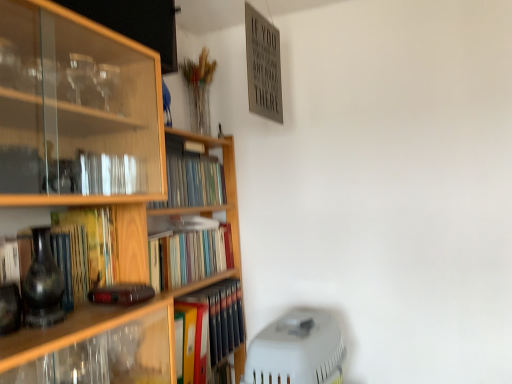
The height and width of the screenshot is (384, 512). What do you see at coordinates (188, 253) in the screenshot? I see `hardcover book at center, which is the 2th book in bottom-to-top order` at bounding box center [188, 253].

I want to click on hardcover book at center-left, the third book ordered from the bottom, so tap(84, 251).

Where is `hardcover book at center, which is the third book in top-to-bottom order`? hardcover book at center, which is the third book in top-to-bottom order is located at coordinates (188, 253).

Can you see hardcover book at center, which is the 2th book in bottom-to-top order, touching hardcover book at center-left, the third book ordered from the bottom?

They are not placed beside each other.

Is hardcover book at center, which is the third book in top-to-bottom order, smaller than hardcover book at center-left, acting as the second book starting from the top?

Incorrect, hardcover book at center, which is the third book in top-to-bottom order, is not smaller in size than hardcover book at center-left, acting as the second book starting from the top.

From their relative heights in the image, would you say hardcover book at center, which is the 2th book in bottom-to-top order, is taller or shorter than hardcover book at center-left, acting as the second book starting from the top?

hardcover book at center, which is the 2th book in bottom-to-top order, is shorter than hardcover book at center-left, acting as the second book starting from the top.

From a real-world perspective, is hardcover book at center, which is the third book in top-to-bottom order, above or below hardcover book at center-left, acting as the second book starting from the top?

hardcover book at center, which is the third book in top-to-bottom order, is situated lower than hardcover book at center-left, acting as the second book starting from the top, in the real world.

Which is behind, point (23, 290) or point (208, 266)?

The point (208, 266) is behind.

Is matte black vase at left oriented away from hardcover book at center, which is the 2th book in bottom-to-top order?

matte black vase at left does not have its back to hardcover book at center, which is the 2th book in bottom-to-top order.

From their relative heights in the image, would you say matte black vase at left is taller or shorter than hardcover book at center, which is the 2th book in bottom-to-top order?

matte black vase at left is taller than hardcover book at center, which is the 2th book in bottom-to-top order.

Is matte black vase at left to the left or to the right of hardcover book at center, which is the third book in top-to-bottom order, in the image?

From the image, it's evident that matte black vase at left is to the left of hardcover book at center, which is the third book in top-to-bottom order.

How many degrees apart are the facing directions of matte black vase at left and hardcover book at center-left, acting as the second book starting from the top?

matte black vase at left and hardcover book at center-left, acting as the second book starting from the top, are facing 0.576 degrees away from each other.

Could you tell me if matte black vase at left is facing hardcover book at center-left, acting as the second book starting from the top?

No, matte black vase at left is not oriented towards hardcover book at center-left, acting as the second book starting from the top.

Considering the sizes of matte black vase at left and hardcover book at center-left, acting as the second book starting from the top, in the image, is matte black vase at left wider or thinner than hardcover book at center-left, acting as the second book starting from the top,?

In the image, matte black vase at left appears to be more narrow than hardcover book at center-left, acting as the second book starting from the top.

Is hardcover book at center-left, the third book ordered from the bottom, inside matte black vase at left?

Definitely not — hardcover book at center-left, the third book ordered from the bottom, is not inside matte black vase at left.

Does hardcover book at center-left, acting as the second book starting from the top, turn towards hardcover books at center, which is the first book in top-to-bottom order?

No.

Is hardcover book at center-left, acting as the second book starting from the top, placed right next to hardcover books at center, which is the first book in top-to-bottom order?

No, hardcover book at center-left, acting as the second book starting from the top, is not with hardcover books at center, which is the first book in top-to-bottom order.

From a real-world perspective, does hardcover book at center-left, acting as the second book starting from the top, sit lower than hardcover books at center, which is the first book in top-to-bottom order?

Yes, from a real-world perspective, hardcover book at center-left, acting as the second book starting from the top, is below hardcover books at center, which is the first book in top-to-bottom order.

Considering the relative positions of matte black vase at left and multicolored hardcover books at center, acting as the 4th book starting from the top, in the image provided, is matte black vase at left to the right of multicolored hardcover books at center, acting as the 4th book starting from the top, from the viewer's perspective?

No, matte black vase at left is not to the right of multicolored hardcover books at center, acting as the 4th book starting from the top.

Is matte black vase at left not near multicolored hardcover books at center, which is the first book in bottom-to-top order?

They are positioned close to each other.

Considering the relative sizes of matte black vase at left and multicolored hardcover books at center, which is the first book in bottom-to-top order, in the image provided, is matte black vase at left wider than multicolored hardcover books at center, which is the first book in bottom-to-top order,?

No, matte black vase at left is not wider than multicolored hardcover books at center, which is the first book in bottom-to-top order.

Considering the relative sizes of matte black vase at left and multicolored hardcover books at center, acting as the 4th book starting from the top, in the image provided, is matte black vase at left bigger than multicolored hardcover books at center, acting as the 4th book starting from the top,?

Actually, matte black vase at left might be smaller than multicolored hardcover books at center, acting as the 4th book starting from the top.

Is matte black vase at left turned away from hardcover books at center, which is the first book in top-to-bottom order?

That's not correct — matte black vase at left is not looking away from hardcover books at center, which is the first book in top-to-bottom order.

Between matte black vase at left and hardcover books at center, which is the first book in top-to-bottom order, which one has larger width?

hardcover books at center, which is the first book in top-to-bottom order, is wider.

From the image's perspective, is matte black vase at left located beneath hardcover books at center, acting as the 4th book starting from the bottom?

Yes, from the image's perspective, matte black vase at left is below hardcover books at center, acting as the 4th book starting from the bottom.

At what (x,y) coordinates should I click in order to perform the action: click on the 1st book to the right of the matte black vase at left, counting from the anchor's position. Please return your answer as a coordinate pair (x, y). The height and width of the screenshot is (384, 512). Looking at the image, I should click on (191, 178).

Considering the relative positions of hardcover book at center, which is the third book in top-to-bottom order, and hardcover books at center, acting as the 4th book starting from the bottom, in the image provided, is hardcover book at center, which is the third book in top-to-bottom order, to the left of hardcover books at center, acting as the 4th book starting from the bottom, from the viewer's perspective?

No.

Looking at this image, from a real-world perspective, which is physically above, hardcover book at center, which is the third book in top-to-bottom order, or hardcover books at center, which is the first book in top-to-bottom order?

hardcover books at center, which is the first book in top-to-bottom order, is physically above.

Can you confirm if hardcover book at center, which is the 2th book in bottom-to-top order, is taller than hardcover books at center, acting as the 4th book starting from the bottom?

Correct, hardcover book at center, which is the 2th book in bottom-to-top order, is much taller as hardcover books at center, acting as the 4th book starting from the bottom.

Could hardcover books at center, which is the first book in top-to-bottom order, be considered to be inside hardcover book at center, which is the third book in top-to-bottom order?

That's incorrect, hardcover books at center, which is the first book in top-to-bottom order, is not inside hardcover book at center, which is the third book in top-to-bottom order.

There is a hardcover book at center-left, the third book ordered from the bottom. Identify the location of the 1st book below it (from a real-world perspective). (188, 253).

I want to click on glass vase located above the hardcover book at center, which is the third book in top-to-bottom order (from a real-world perspective), so click(x=42, y=284).

From the image, which object appears to be farther from matte black vase at left, hardcover book at center, which is the third book in top-to-bottom order, or multicolored hardcover books at center, which is the first book in bottom-to-top order?

multicolored hardcover books at center, which is the first book in bottom-to-top order, lies further to matte black vase at left than the other object.

Based on their spatial positions, is hardcover book at center, which is the 2th book in bottom-to-top order, or wooden bookshelf at left further from hardcover books at center, acting as the 4th book starting from the bottom?

hardcover book at center, which is the 2th book in bottom-to-top order, lies further to hardcover books at center, acting as the 4th book starting from the bottom, than the other object.

From the image, which object appears to be nearer to wooden bookshelf at left, hardcover book at center, which is the third book in top-to-bottom order, or hardcover books at center, which is the first book in top-to-bottom order?

hardcover books at center, which is the first book in top-to-bottom order, is positioned closer to the anchor wooden bookshelf at left.

Looking at the image, which one is located further to hardcover books at center, acting as the 4th book starting from the bottom, matte black vase at left or hardcover book at center-left, the third book ordered from the bottom?

The object further to hardcover books at center, acting as the 4th book starting from the bottom, is matte black vase at left.

From the image, which object appears to be nearer to hardcover book at center-left, acting as the second book starting from the top, hardcover book at center, which is the 2th book in bottom-to-top order, or wooden bookshelf at left?

hardcover book at center, which is the 2th book in bottom-to-top order.

Considering their positions, is hardcover book at center, which is the 2th book in bottom-to-top order, positioned further to hardcover books at center, which is the first book in top-to-bottom order, than hardcover book at center-left, the third book ordered from the bottom?

Among the two, hardcover book at center-left, the third book ordered from the bottom, is located further to hardcover books at center, which is the first book in top-to-bottom order.

Considering their positions, is hardcover book at center-left, acting as the second book starting from the top, positioned closer to wooden bookshelf at left than multicolored hardcover books at center, which is the first book in bottom-to-top order?

multicolored hardcover books at center, which is the first book in bottom-to-top order, is positioned closer to the anchor wooden bookshelf at left.

Considering their positions, is wooden bookshelf at left positioned closer to multicolored hardcover books at center, acting as the 4th book starting from the top, than hardcover book at center-left, acting as the second book starting from the top?

Among the two, wooden bookshelf at left is located nearer to multicolored hardcover books at center, acting as the 4th book starting from the top.

At what (x,y) coordinates should I click in order to perform the action: click on bookshelf between hardcover books at center, acting as the 4th book starting from the bottom, and multicolored hardcover books at center, which is the first book in bottom-to-top order, vertically. Please return your answer as a coordinate pair (x, y). Looking at the image, I should click on (216, 205).

In order to click on bookshelf between hardcover book at center-left, the third book ordered from the bottom, and multicolored hardcover books at center, acting as the 4th book starting from the top, along the z-axis in this screenshot , I will do `click(216, 205)`.

At what (x,y) coordinates should I click in order to perform the action: click on bookshelf situated between hardcover book at center-left, acting as the second book starting from the top, and hardcover book at center, which is the 2th book in bottom-to-top order, from left to right. Please return your answer as a coordinate pair (x, y). The image size is (512, 384). Looking at the image, I should click on (216, 205).

You are a GUI agent. You are given a task and a screenshot of the screen. Output one action in this format:
    pyautogui.click(x=<x>, y=<y>)
    Task: Click on the book between hardcover book at center-left, the third book ordered from the bottom, and multicolored hardcover books at center, acting as the 4th book starting from the top, from top to bottom
    
    Given the screenshot: What is the action you would take?
    pyautogui.click(x=188, y=253)